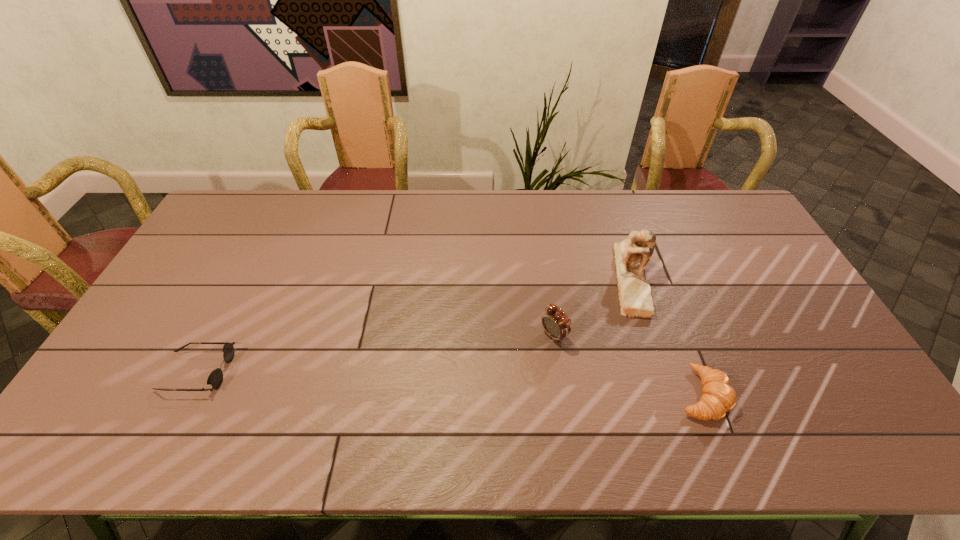
Find the location of a particular element. The width and height of the screenshot is (960, 540). free location at the near edge of the desktop is located at coordinates (433, 390).

Image resolution: width=960 pixels, height=540 pixels. I want to click on vacant space at the right edge of the desktop, so click(x=803, y=314).

Locate an element on the screen. The width and height of the screenshot is (960, 540). free spot at the far left corner of the desktop is located at coordinates (267, 195).

The width and height of the screenshot is (960, 540). I want to click on free space at the near right corner of the desktop, so click(814, 397).

The image size is (960, 540). What are the coordinates of `free space between the crescent roll and the figurine` in the screenshot? It's located at (666, 336).

You are a GUI agent. You are given a task and a screenshot of the screen. Output one action in this format:
    pyautogui.click(x=<x>, y=<y>)
    Task: Click on the vacant space in between the alarm clock and the leftmost object
    This screenshot has height=540, width=960.
    Given the screenshot: What is the action you would take?
    pyautogui.click(x=375, y=353)

At what (x,y) coordinates should I click in order to perform the action: click on free space between the figurine and the second tallest object. Please return your answer as a coordinate pair (x, y). The image size is (960, 540). Looking at the image, I should click on (592, 306).

Where is `free area in between the tallest object and the leftmost object`? The height and width of the screenshot is (540, 960). free area in between the tallest object and the leftmost object is located at coordinates (414, 324).

Identify the location of free space between the tallest object and the leftmost object. (414, 324).

Where is `vacant area between the second farthest object and the figurine`? Image resolution: width=960 pixels, height=540 pixels. vacant area between the second farthest object and the figurine is located at coordinates (592, 306).